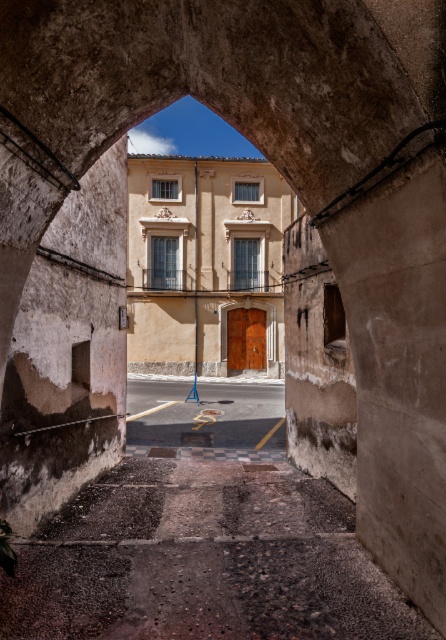
In the scene shown: You are a delivery person approaching the building through the archway. You need to park your vehicle on the smooth asphalt road at center and then reach the brown wooden door at center. Based on their sizes, which one will require more space to accommodate your vehicle and movement?

The smooth asphalt road at center is larger in size than the brown wooden door at center, so the road will require more space to accommodate the vehicle and movement.

You are standing at the entrance of the archway and want to reach the building in the background. Which direction should you walk to follow the smooth asphalt road at center?

Since the smooth asphalt road at center is positioned at coordinates point (205, 413), you should walk towards the center of the image to follow the smooth asphalt road at center.